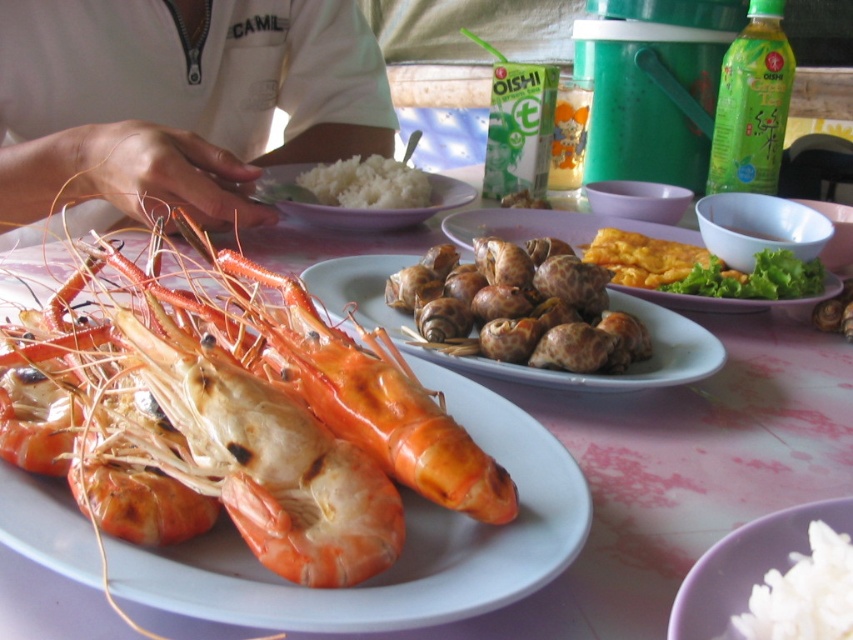
Question: Which of these objects is positioned closest to the shiny orange prawn at center?

Choices:
 (A) white matte shirt at upper left
 (B) smooth brown snail at center
 (C) white matte rice at lower right

Answer: (C)

Question: Is yellowish fried egg at center right to the left of white matte rice at center from the viewer's perspective?

Choices:
 (A) yes
 (B) no

Answer: (B)

Question: Which point is farther to the camera?

Choices:
 (A) shiny orange prawn at center
 (B) smooth white table at center
 (C) white matte rice at lower right

Answer: (A)

Question: Is white matte rice at lower right thinner than yellow fried egg at center?

Choices:
 (A) no
 (B) yes

Answer: (B)

Question: From the image, what is the correct spatial relationship of white matte rice at lower right in relation to white matte rice at center?

Choices:
 (A) below
 (B) above

Answer: (A)

Question: Which is nearer to the green matte bottle at upper right?

Choices:
 (A) shiny orange prawn at center
 (B) white matte rice at lower right
 (C) yellowish fried egg at center right
 (D) smooth brown snail at center

Answer: (D)